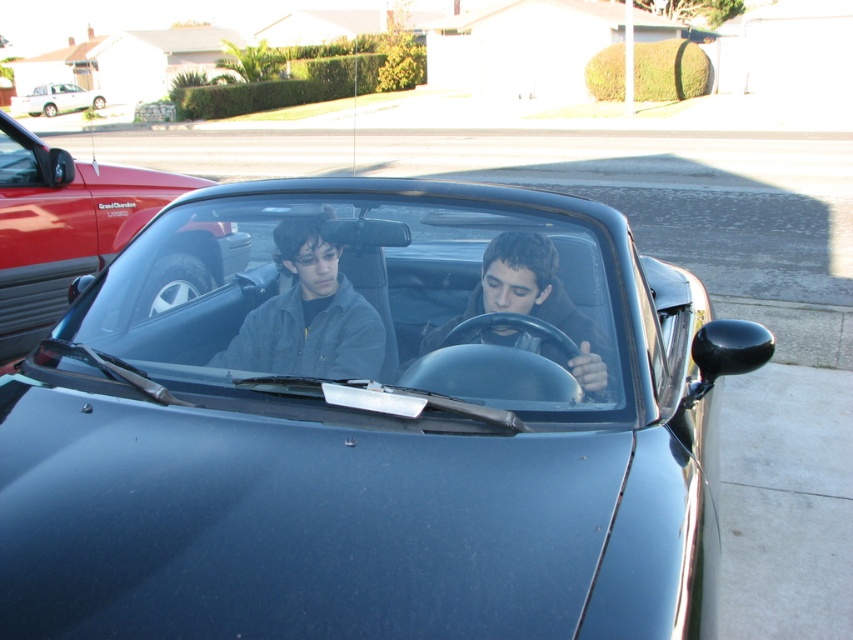
Question: Which object is closer to the camera taking this photo?

Choices:
 (A) transparent glass windshield at center
 (B) white matte sedan at upper left

Answer: (A)

Question: Is transparent glass windshield at center below shiny black convertible at center?

Choices:
 (A) yes
 (B) no

Answer: (A)

Question: Which object is the closest to the shiny black convertible at center?

Choices:
 (A) dark brown leather jacket at center
 (B) glossy black convertible at center
 (C) transparent glass windshield at center
 (D) dark gray jacket at center

Answer: (C)

Question: Does glossy black convertible at center come in front of dark brown leather jacket at center?

Choices:
 (A) yes
 (B) no

Answer: (A)

Question: Which object is farther from the camera taking this photo?

Choices:
 (A) transparent glass windshield at center
 (B) dark brown leather jacket at center
 (C) shiny black convertible at center

Answer: (C)

Question: Can you confirm if transparent glass windshield at center is positioned above dark brown leather jacket at center?

Choices:
 (A) no
 (B) yes

Answer: (B)